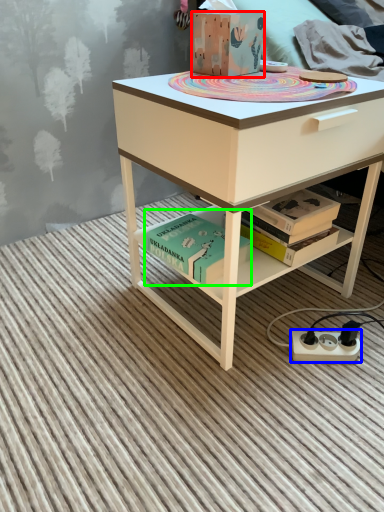
Question: Considering the real-world distances, which object is farthest from box (highlighted by a red box)? power plugs and sockets (highlighted by a blue box) or book (highlighted by a green box)?

Choices:
 (A) power plugs and sockets
 (B) book

Answer: (A)